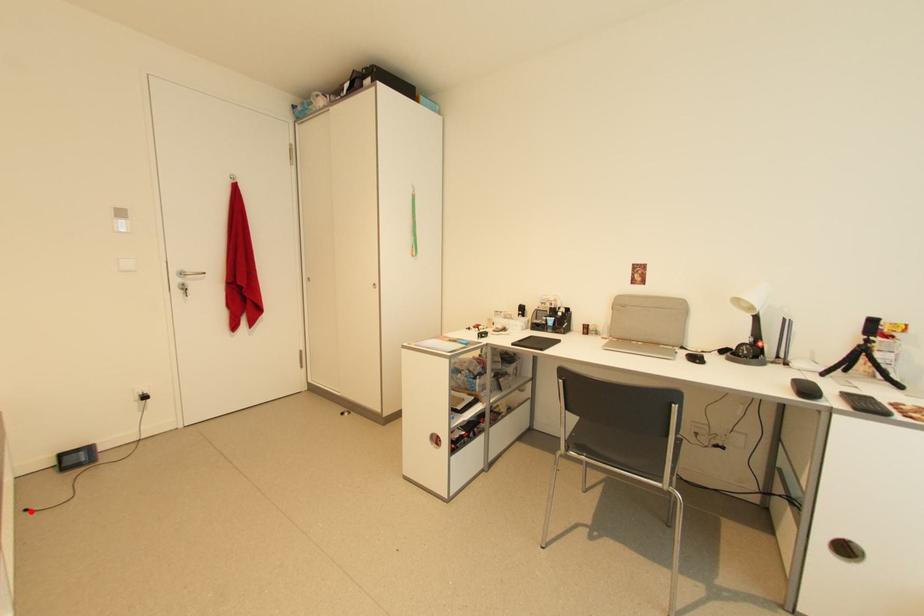
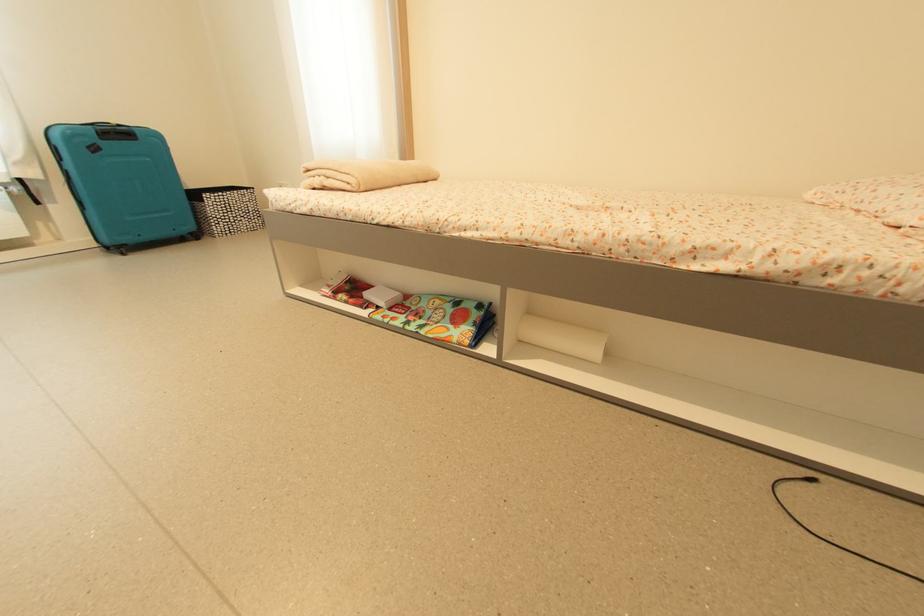
The point at the highlighted location is marked in the first image. Where is the corresponding point in the second image?

(817, 483)